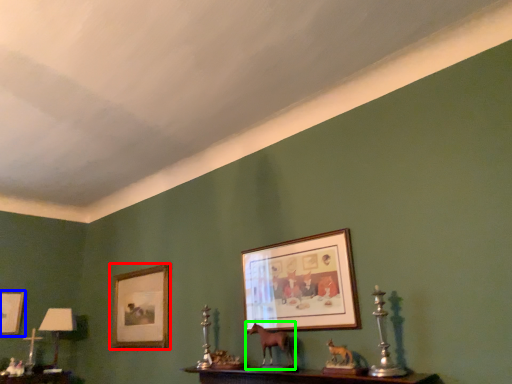
Question: Based on their relative distances, which object is nearer to picture frame (highlighted by a red box)? Choose from picture frame (highlighted by a blue box) and animal (highlighted by a green box).

Choices:
 (A) picture frame
 (B) animal

Answer: (A)